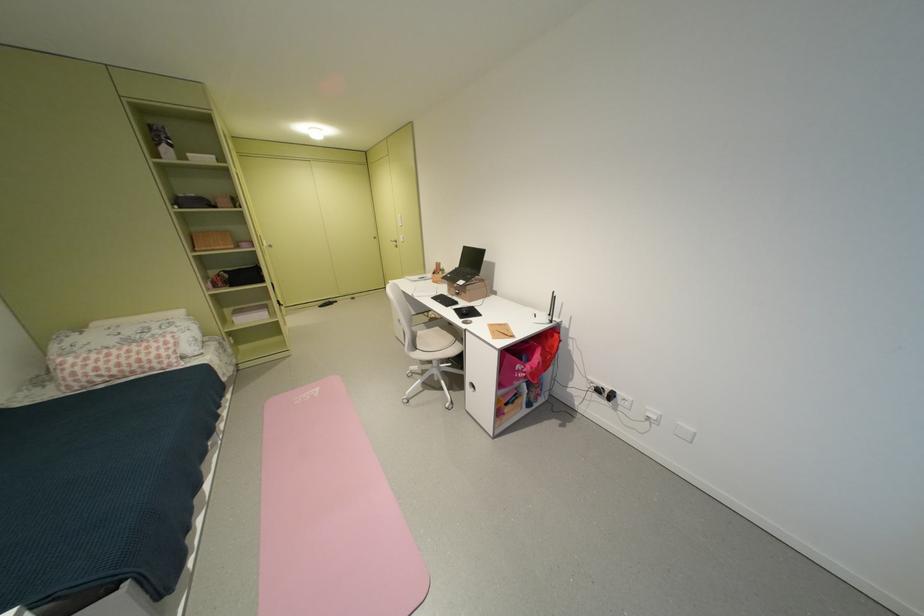
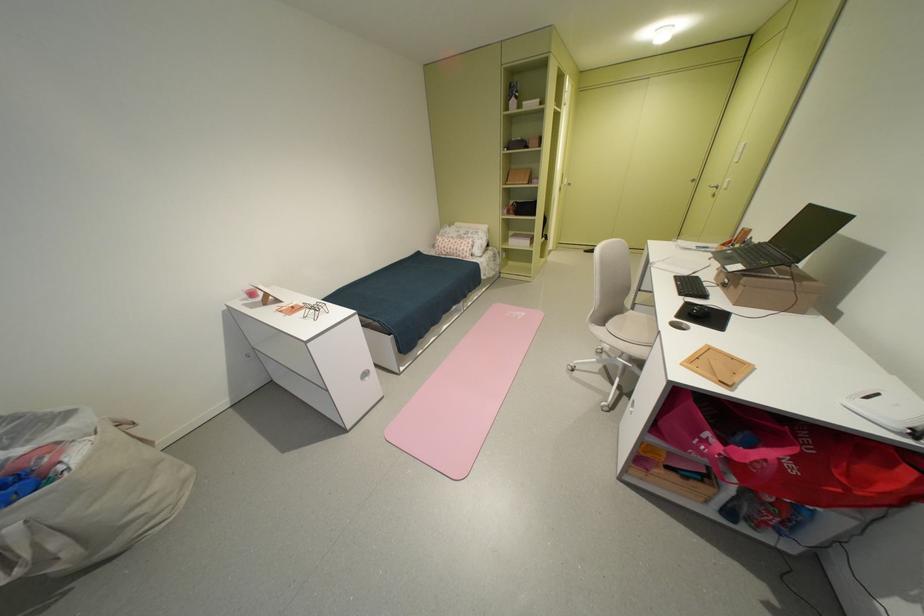
The point at (x=428, y=349) is marked in the first image. Where is the corresponding point in the second image?

(615, 326)